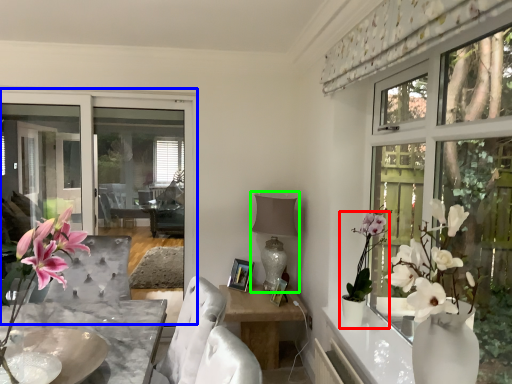
Question: Estimate the real-world distances between objects in this image. Which object is farther from houseplant (highlighted by a red box), window screen (highlighted by a blue box) or lamp (highlighted by a green box)?

Choices:
 (A) window screen
 (B) lamp

Answer: (A)